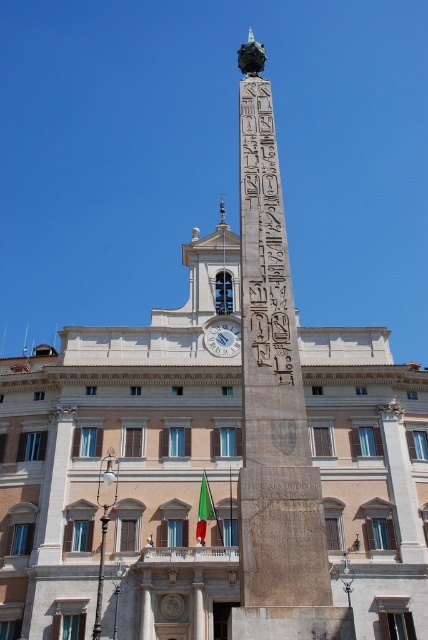
Question: Does white marble clock at center come behind green fabric flag at lower center?

Choices:
 (A) yes
 (B) no

Answer: (A)

Question: Which of these objects is positioned farthest from the white marble clock at center?

Choices:
 (A) black stone hieroglyphs at center
 (B) granite obelisk at center

Answer: (B)

Question: Can you confirm if granite obelisk at center is positioned below black stone hieroglyphs at center?

Choices:
 (A) no
 (B) yes

Answer: (A)

Question: Does white marble clock at center lie in front of green fabric flag at lower center?

Choices:
 (A) yes
 (B) no

Answer: (B)

Question: Which of the following is the farthest from the observer?

Choices:
 (A) green fabric flag at lower center
 (B) granite obelisk at center
 (C) white marble clock at center

Answer: (C)

Question: Based on their relative distances, which object is nearer to the granite obelisk at center?

Choices:
 (A) black stone hieroglyphs at center
 (B) green fabric flag at lower center
 (C) white marble clock at center

Answer: (A)